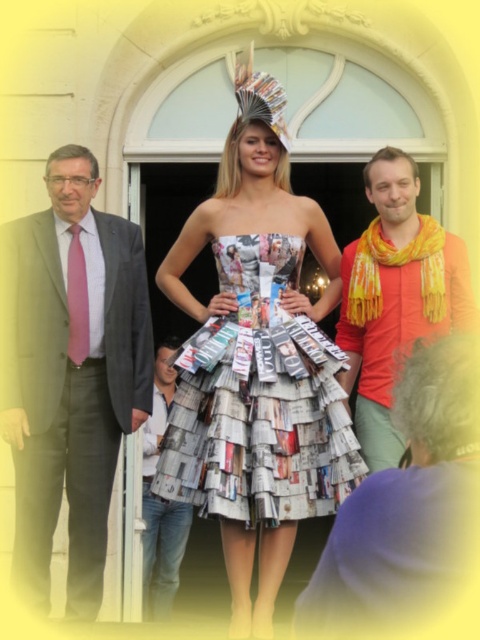
In the scene shown: Does pink silk tie at left have a smaller size compared to printed newspaper dress at center?

No, pink silk tie at left is not smaller than printed newspaper dress at center.

Who is more distant from viewer, (x=55, y=248) or (x=167, y=496)?

Positioned behind is point (x=55, y=248).

Which is in front, point (59, 468) or point (276, 278)?

Point (59, 468) is more forward.

This screenshot has width=480, height=640. I want to click on pink silk tie at left, so click(70, 372).

Is printed newspaper dress at center thinner than orange scarf at right?

No, printed newspaper dress at center is not thinner than orange scarf at right.

Does printed newspaper dress at center come in front of orange scarf at right?

No, it is not.

What do you see at coordinates (260, 401) in the screenshot? The width and height of the screenshot is (480, 640). I see `printed newspaper dress at center` at bounding box center [260, 401].

This screenshot has width=480, height=640. What are the coordinates of `printed newspaper dress at center` in the screenshot? It's located at (260, 401).

Between pink silk tie at left and orange scarf at right, which one is positioned lower?

Answer: Positioned lower is pink silk tie at left.

Which is behind, point (120, 412) or point (392, 364)?

The point (392, 364) is more distant.

Measure the distance between pink silk tie at left and camera.

pink silk tie at left and camera are 130.96 feet apart.

Locate an element on the screen. The image size is (480, 640). pink silk tie at left is located at coordinates (70, 372).